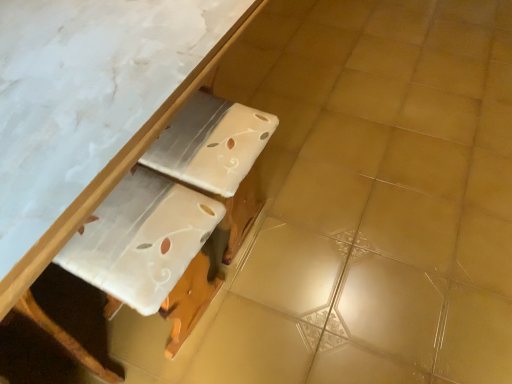
Question: Is white glossy table at upper center oriented towards white glossy cardboard at center?

Choices:
 (A) yes
 (B) no

Answer: (A)

Question: From a real-world perspective, is white glossy table at upper center over white glossy cardboard at center?

Choices:
 (A) no
 (B) yes

Answer: (B)

Question: Would you say white glossy table at upper center is a long distance from white glossy cardboard at center?

Choices:
 (A) no
 (B) yes

Answer: (A)

Question: From the image's perspective, is white glossy table at upper center on white glossy cardboard at center?

Choices:
 (A) yes
 (B) no

Answer: (A)

Question: Considering the relative positions of white glossy table at upper center and white glossy cardboard at center in the image provided, is white glossy table at upper center behind white glossy cardboard at center?

Choices:
 (A) no
 (B) yes

Answer: (A)

Question: Considering the relative sizes of white glossy table at upper center and white glossy cardboard at center in the image provided, is white glossy table at upper center shorter than white glossy cardboard at center?

Choices:
 (A) no
 (B) yes

Answer: (A)

Question: Considering the relative sizes of white glossy cardboard at center and white glossy table at upper center in the image provided, is white glossy cardboard at center thinner than white glossy table at upper center?

Choices:
 (A) yes
 (B) no

Answer: (A)

Question: Is white glossy cardboard at center facing towards white glossy table at upper center?

Choices:
 (A) no
 (B) yes

Answer: (B)

Question: Is white glossy cardboard at center positioned behind white glossy table at upper center?

Choices:
 (A) yes
 (B) no

Answer: (A)

Question: Is white glossy cardboard at center at the right side of white glossy table at upper center?

Choices:
 (A) yes
 (B) no

Answer: (A)

Question: From a real-world perspective, is white glossy cardboard at center on top of white glossy table at upper center?

Choices:
 (A) no
 (B) yes

Answer: (A)

Question: Does white glossy cardboard at center have a smaller size compared to white glossy table at upper center?

Choices:
 (A) no
 (B) yes

Answer: (B)

Question: Relative to white glossy cardboard at center, is white glossy table at upper center in front or behind?

Choices:
 (A) behind
 (B) front

Answer: (B)